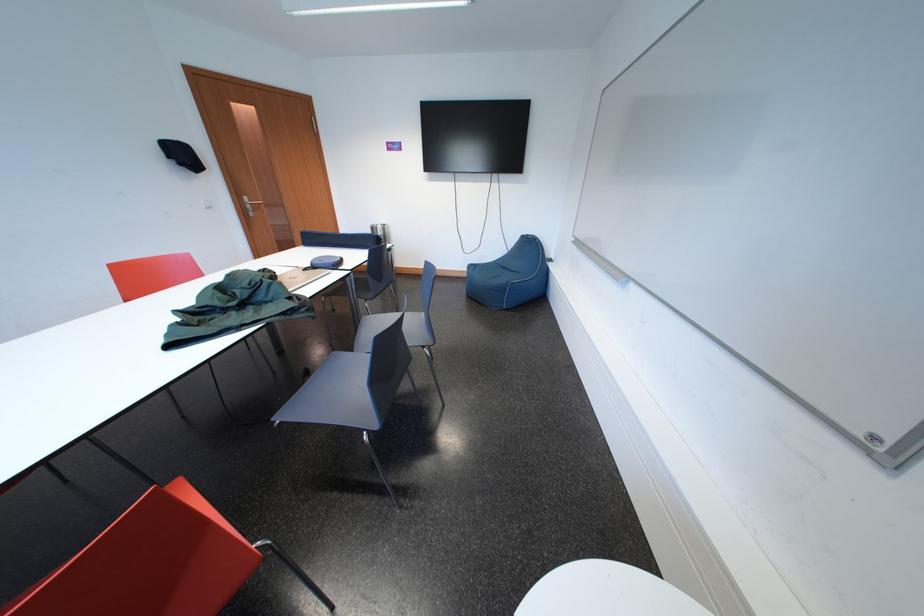
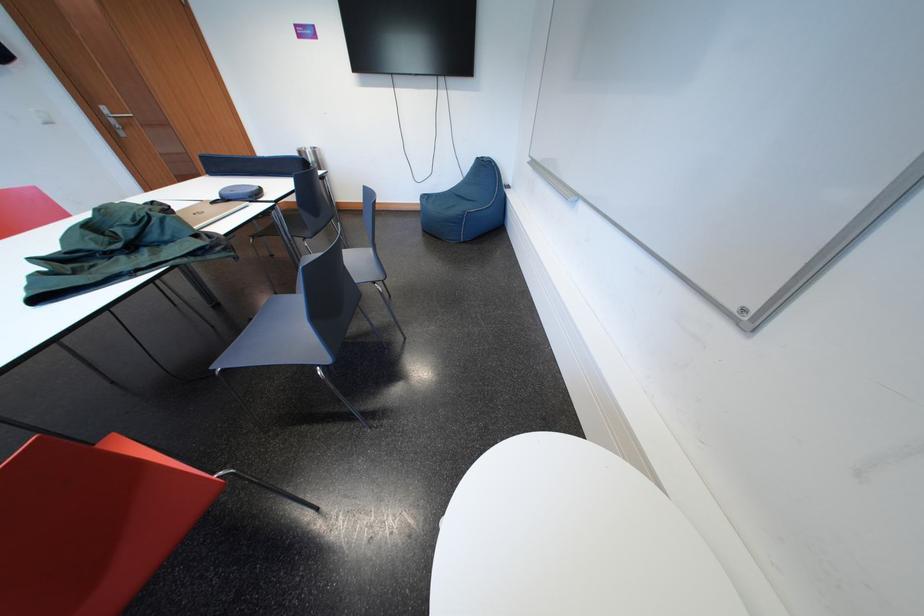
Find the pixel in the second image that matches pixel 254 203 in the first image.

(113, 113)